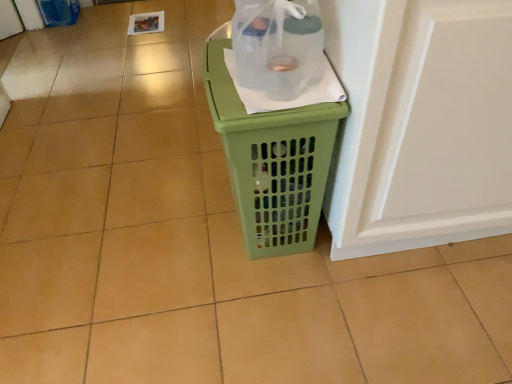
Measure the distance between point [401,194] and camera.

Point [401,194] is 1.05 meters from camera.

What is the approximate height of white glossy screen door at right?

It is 30.58 inches.

Where is `green plastic laundry basket at center`? The width and height of the screenshot is (512, 384). green plastic laundry basket at center is located at coordinates (273, 162).

I want to click on white glossy screen door at right, so click(420, 123).

Is green plastic laundry basket at center directly adjacent to white glossy screen door at right?

green plastic laundry basket at center and white glossy screen door at right are clearly separated.

How different are the orientations of green plastic laundry basket at center and white glossy screen door at right in degrees?

There is a 90.8-degree angle between the facing directions of green plastic laundry basket at center and white glossy screen door at right.

Can you confirm if green plastic laundry basket at center is smaller than white glossy screen door at right?

Indeed, green plastic laundry basket at center has a smaller size compared to white glossy screen door at right.

Can you confirm if green plastic laundry basket at center is positioned to the right of white glossy screen door at right?

No.

Between transparent plastic bottle at center and green plastic laundry basket at center, which one has larger size?

green plastic laundry basket at center.

Visually, is transparent plastic bottle at center positioned to the left or to the right of green plastic laundry basket at center?

From the image, it's evident that transparent plastic bottle at center is to the left of green plastic laundry basket at center.

Is transparent plastic bottle at center not inside green plastic laundry basket at center?

Yes, transparent plastic bottle at center is not within green plastic laundry basket at center.

Which is behind, green plastic laundry basket at center or transparent plastic bottle at center?

green plastic laundry basket at center is further away from the camera.

Does green plastic laundry basket at center appear on the left side of transparent plastic bottle at center?

No, green plastic laundry basket at center is not to the left of transparent plastic bottle at center.

Is transparent plastic bottle at center at the back of green plastic laundry basket at center?

No, green plastic laundry basket at center's orientation is not away from transparent plastic bottle at center.

From the image's perspective, which is below, green plastic laundry basket at center or transparent plastic bottle at center?

green plastic laundry basket at center.

From a real-world perspective, which is physically above, transparent plastic bottle at center or white glossy screen door at right?

From a 3D spatial view, transparent plastic bottle at center is above.

Between transparent plastic bottle at center and white glossy screen door at right, which one has smaller size?

With smaller size is transparent plastic bottle at center.

Is transparent plastic bottle at center next to white glossy screen door at right?

No, transparent plastic bottle at center is not next to white glossy screen door at right.

Can you confirm if transparent plastic bottle at center is shorter than white glossy screen door at right?

Yes, transparent plastic bottle at center is shorter than white glossy screen door at right.

Between white glossy screen door at right and transparent plastic bottle at center, which one has smaller size?

With smaller size is transparent plastic bottle at center.

The image size is (512, 384). Find the location of `bottle above the white glossy screen door at right (from a real-world perspective)`. bottle above the white glossy screen door at right (from a real-world perspective) is located at coordinates (278, 46).

From the image's perspective, is white glossy screen door at right beneath transparent plastic bottle at center?

Yes.

Does white glossy screen door at right contain transparent plastic bottle at center?

No, white glossy screen door at right does not contain transparent plastic bottle at center.

Considering the sizes of objects white glossy screen door at right and green plastic laundry basket at center in the image provided, who is taller, white glossy screen door at right or green plastic laundry basket at center?

white glossy screen door at right is taller.

Can you tell me how much white glossy screen door at right and green plastic laundry basket at center differ in facing direction?

90.8 degrees separate the facing orientations of white glossy screen door at right and green plastic laundry basket at center.

Is white glossy screen door at right facing away from green plastic laundry basket at center?

white glossy screen door at right does not have its back to green plastic laundry basket at center.

From the image's perspective, is white glossy screen door at right above or below green plastic laundry basket at center?

white glossy screen door at right is above green plastic laundry basket at center.

The image size is (512, 384). Find the location of `screen door on the right of green plastic laundry basket at center`. screen door on the right of green plastic laundry basket at center is located at coordinates (420, 123).

Where is `waste container below the transparent plastic bottle at center (from the image's perspective)`? This screenshot has width=512, height=384. waste container below the transparent plastic bottle at center (from the image's perspective) is located at coordinates (273, 162).

Estimate the real-world distances between objects in this image. Which object is further from white glossy screen door at right, green plastic laundry basket at center or transparent plastic bottle at center?

The object further to white glossy screen door at right is transparent plastic bottle at center.

Estimate the real-world distances between objects in this image. Which object is further from green plastic laundry basket at center, transparent plastic bottle at center or white glossy screen door at right?

white glossy screen door at right is further to green plastic laundry basket at center.

From the image, which object appears to be nearer to white glossy screen door at right, transparent plastic bottle at center or green plastic laundry basket at center?

Based on the image, green plastic laundry basket at center appears to be nearer to white glossy screen door at right.

Considering their positions, is white glossy screen door at right positioned further to transparent plastic bottle at center than green plastic laundry basket at center?

white glossy screen door at right.

Considering their positions, is white glossy screen door at right positioned closer to green plastic laundry basket at center than transparent plastic bottle at center?

transparent plastic bottle at center lies closer to green plastic laundry basket at center than the other object.

Estimate the real-world distances between objects in this image. Which object is further from transparent plastic bottle at center, green plastic laundry basket at center or white glossy screen door at right?

white glossy screen door at right is further to transparent plastic bottle at center.

Image resolution: width=512 pixels, height=384 pixels. I want to click on waste container located between transparent plastic bottle at center and white glossy screen door at right in the left-right direction, so click(273, 162).